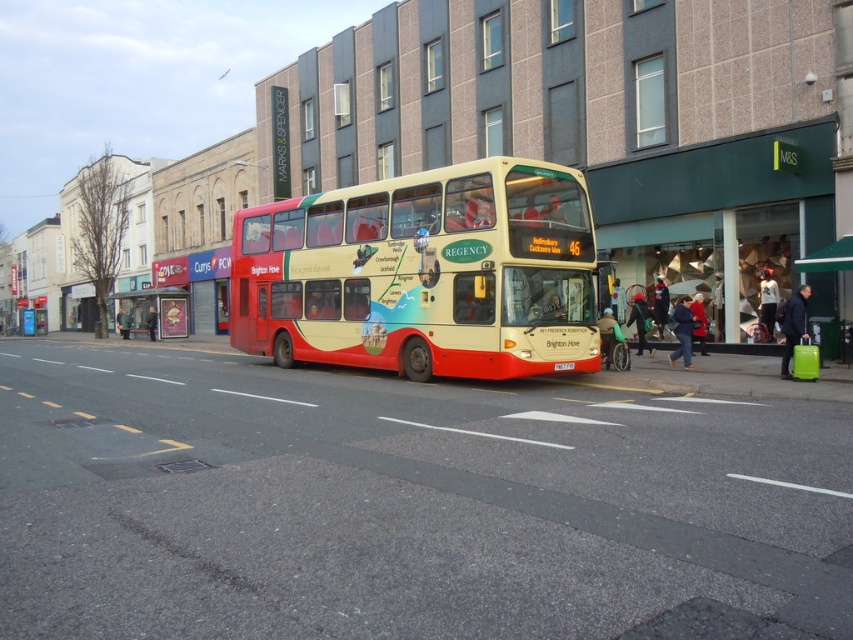
Question: Which point is farther from the camera taking this photo?

Choices:
 (A) (166, 323)
 (B) (572, 365)

Answer: (A)

Question: Can you confirm if beige glossy double-decker bus at center is positioned to the right of metallic silver bus stop at center?

Choices:
 (A) no
 (B) yes

Answer: (B)

Question: Which point is closer to the camera?

Choices:
 (A) (567, 362)
 (B) (453, 224)
 (C) (123, 326)

Answer: (A)

Question: Does beige glossy double-decker bus at center come behind white plastic license plate at center?

Choices:
 (A) yes
 (B) no

Answer: (B)

Question: Estimate the real-world distances between objects in this image. Which object is closer to the white plastic license plate at center?

Choices:
 (A) beige glossy double-decker bus at center
 (B) metallic silver bus stop at center

Answer: (A)

Question: Where is metallic silver bus stop at center located in relation to white plastic license plate at center in the image?

Choices:
 (A) right
 (B) left

Answer: (B)